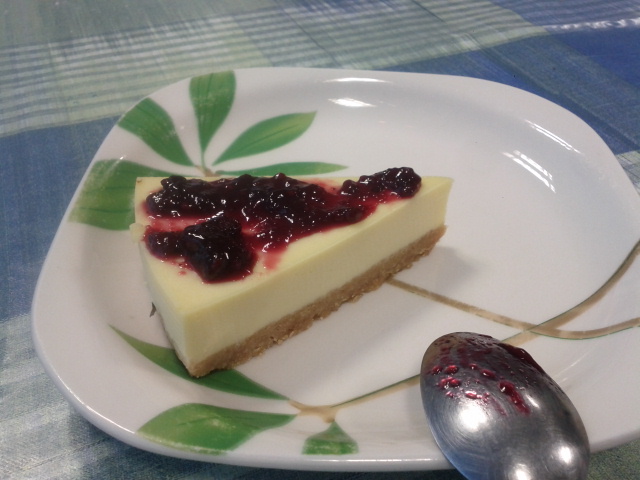
At what (x,y) coordinates should I click in order to perform the action: click on white rounded square plate. Please return your answer as a coordinate pair (x, y). Image resolution: width=640 pixels, height=480 pixels. Looking at the image, I should click on (89, 376).